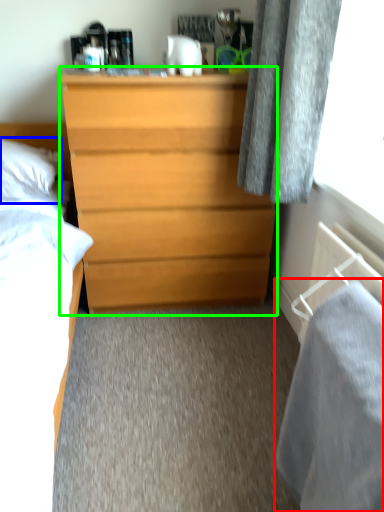
Question: Which object is the closest to the sheet (highlighted by a red box)? Choose among these: pillow (highlighted by a blue box) or chest of drawers (highlighted by a green box).

Choices:
 (A) pillow
 (B) chest of drawers

Answer: (B)